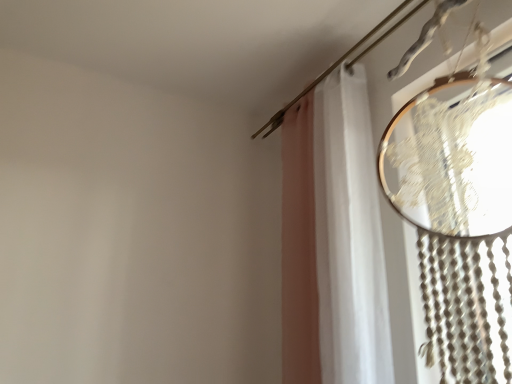
Locate an element on the screen. white sheer curtain at upper right is located at coordinates (349, 236).

Image resolution: width=512 pixels, height=384 pixels. What do you see at coordinates (349, 236) in the screenshot?
I see `white sheer curtain at upper right` at bounding box center [349, 236].

Measure the distance between point (370, 258) and camera.

Point (370, 258) is 1.44 meters away from camera.

Describe the element at coordinates (339, 244) in the screenshot. Image resolution: width=512 pixels, height=384 pixels. I see `white fabric curtain at right` at that location.

Locate an element on the screen. The width and height of the screenshot is (512, 384). white fabric curtain at right is located at coordinates (339, 244).

Find the location of a particular element. The image size is (512, 384). white sheer curtain at upper right is located at coordinates (349, 236).

Looking at this image, which object is positioned more to the right, white fabric curtain at right or white sheer curtain at upper right?

Positioned to the right is white fabric curtain at right.

Considering their positions, is white fabric curtain at right located in front of or behind white sheer curtain at upper right?

white fabric curtain at right is in front of white sheer curtain at upper right.

Which is closer to the camera, (288, 336) or (344, 169)?

Clearly, point (288, 336) is more distant from the camera than point (344, 169).

Consider the image. From the image's perspective, relative to white sheer curtain at upper right, is white fabric curtain at right above or below?

Clearly, from the image's perspective, white fabric curtain at right is above white sheer curtain at upper right.

From a real-world perspective, who is located higher, white fabric curtain at right or white sheer curtain at upper right?

white fabric curtain at right.

Is white fabric curtain at right thinner than white sheer curtain at upper right?

In fact, white fabric curtain at right might be wider than white sheer curtain at upper right.

Is white fabric curtain at right taller or shorter than white sheer curtain at upper right?

white fabric curtain at right is shorter than white sheer curtain at upper right.

Who is bigger, white fabric curtain at right or white sheer curtain at upper right?

With larger size is white sheer curtain at upper right.

Is white fabric curtain at right situated inside white sheer curtain at upper right or outside?

white fabric curtain at right lies outside white sheer curtain at upper right.

Is white fabric curtain at right far from white sheer curtain at upper right?

No.

Is white fabric curtain at right aimed at white sheer curtain at upper right?

No, white fabric curtain at right is not oriented towards white sheer curtain at upper right.

What's the angular difference between white fabric curtain at right and white sheer curtain at upper right's facing directions?

The angular difference between white fabric curtain at right and white sheer curtain at upper right is 1.13 degrees.

How far apart are white fabric curtain at right and white sheer curtain at upper right?

The distance of white fabric curtain at right from white sheer curtain at upper right is 2.22 inches.

In the image, there is a white fabric curtain at right. Identify the location of shower curtain below it (from the image's perspective). This screenshot has height=384, width=512. (349, 236).

Which is more to the right, white sheer curtain at upper right or white fabric curtain at right?

From the viewer's perspective, white fabric curtain at right appears more on the right side.

Is white sheer curtain at upper right in front of or behind white fabric curtain at right in the image?

Visually, white sheer curtain at upper right is located behind white fabric curtain at right.

Between point (354, 285) and point (283, 134), which one is positioned behind?

The point (283, 134) is farther.

From the image's perspective, who appears lower, white sheer curtain at upper right or white fabric curtain at right?

white sheer curtain at upper right.

In the scene shown: From a real-world perspective, is white sheer curtain at upper right positioned above or below white fabric curtain at right?

In terms of real-world spatial position, white sheer curtain at upper right is below white fabric curtain at right.

In the scene shown: Which object is thinner, white sheer curtain at upper right or white fabric curtain at right?

With smaller width is white sheer curtain at upper right.

Can you confirm if white sheer curtain at upper right is taller than white fabric curtain at right?

Yes.

Between white sheer curtain at upper right and white fabric curtain at right, which one has larger size?

white sheer curtain at upper right is bigger.

Is white sheer curtain at upper right spatially inside white fabric curtain at right, or outside of it?

white sheer curtain at upper right is outside white fabric curtain at right.

Is white sheer curtain at upper right not near white fabric curtain at right?

No, white sheer curtain at upper right is in close proximity to white fabric curtain at right.

Is white sheer curtain at upper right positioned with its back to white fabric curtain at right?

That's not correct — white sheer curtain at upper right is not looking away from white fabric curtain at right.

What's the angular difference between white sheer curtain at upper right and white fabric curtain at right's facing directions?

They differ by 1.13 degrees in their facing directions.

The image size is (512, 384). I want to click on shower curtain behind the white fabric curtain at right, so click(x=349, y=236).

You are a GUI agent. You are given a task and a screenshot of the screen. Output one action in this format:
    pyautogui.click(x=<x>, y=<y>)
    Task: Click on the shower curtain lying behind the white fabric curtain at right
    This screenshot has height=384, width=512.
    Given the screenshot: What is the action you would take?
    pyautogui.click(x=349, y=236)

This screenshot has width=512, height=384. In the image, there is a white fabric curtain at right. In order to click on shower curtain below it (from a real-world perspective) in this screenshot , I will do `click(349, 236)`.